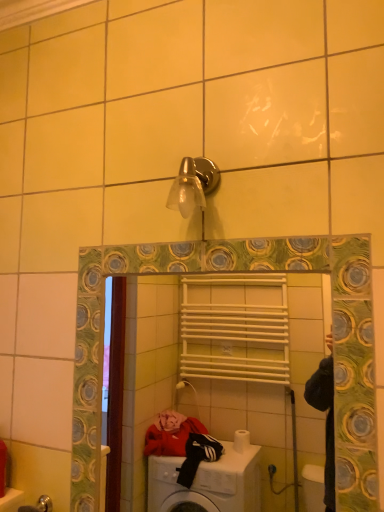
The height and width of the screenshot is (512, 384). Find the location of `matte glass shower head at upper center`. matte glass shower head at upper center is located at coordinates (193, 185).

Image resolution: width=384 pixels, height=512 pixels. What do you see at coordinates (193, 185) in the screenshot? I see `matte glass shower head at upper center` at bounding box center [193, 185].

Identify the location of matte glass shower head at upper center. point(193,185).